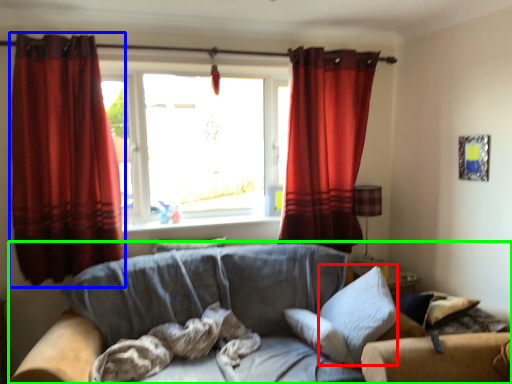
Question: Considering the real-world distances, which object is closest to pillow (highlighted by a red box)? curtain (highlighted by a blue box) or studio couch (highlighted by a green box).

Choices:
 (A) curtain
 (B) studio couch

Answer: (B)